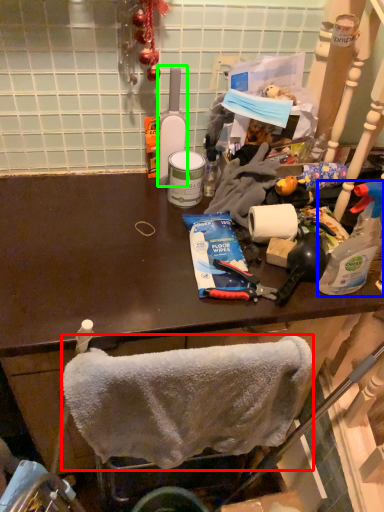
Question: Which is nearer to the towel/napkin (highlighted by a red box)? bottle (highlighted by a blue box) or bottle (highlighted by a green box).

Choices:
 (A) bottle
 (B) bottle

Answer: (A)